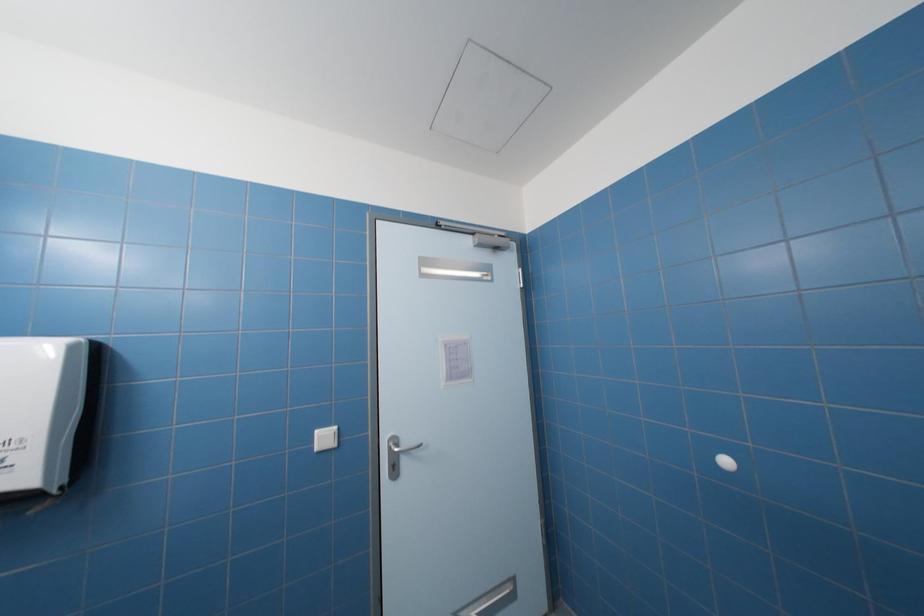
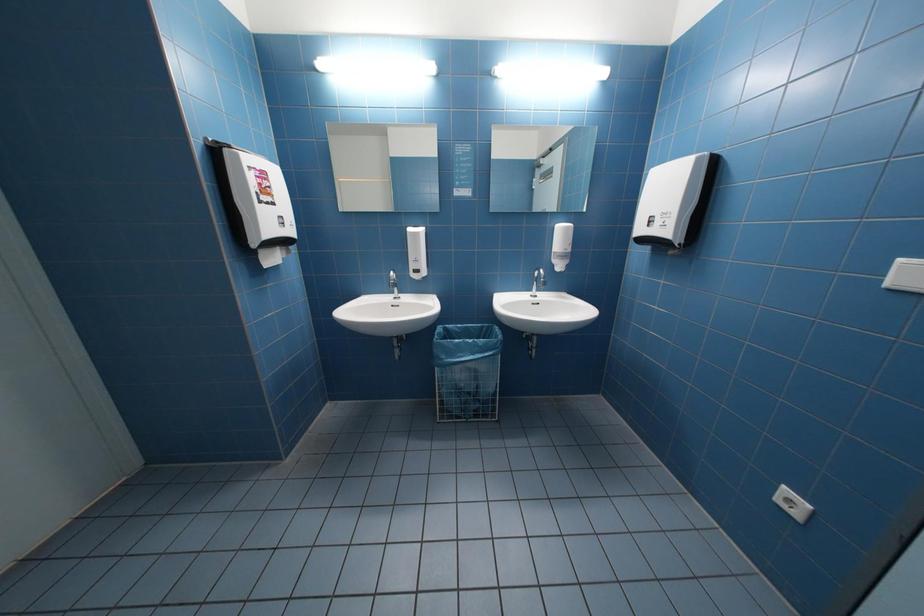
How did the camera likely rotate?

The camera's rotation is toward left-down.